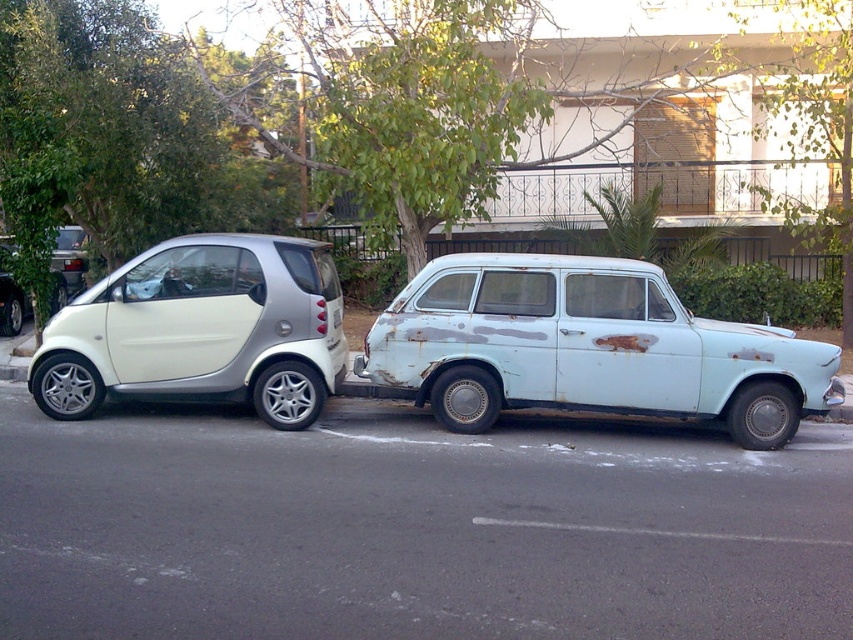
Question: Where is rusty metal car at right located in relation to metallic silver car at left in the image?

Choices:
 (A) below
 (B) above

Answer: (A)

Question: Which object appears closest to the camera in this image?

Choices:
 (A) metallic silver car at left
 (B) rusty metal car at right

Answer: (B)

Question: Does rusty metal car at right appear on the left side of metallic silver car at left?

Choices:
 (A) no
 (B) yes

Answer: (A)

Question: Which of the following is the farthest from the observer?

Choices:
 (A) rusty metal car at right
 (B) metallic silver car at left

Answer: (B)

Question: Can you confirm if rusty metal car at right is positioned below metallic silver car at left?

Choices:
 (A) yes
 (B) no

Answer: (A)